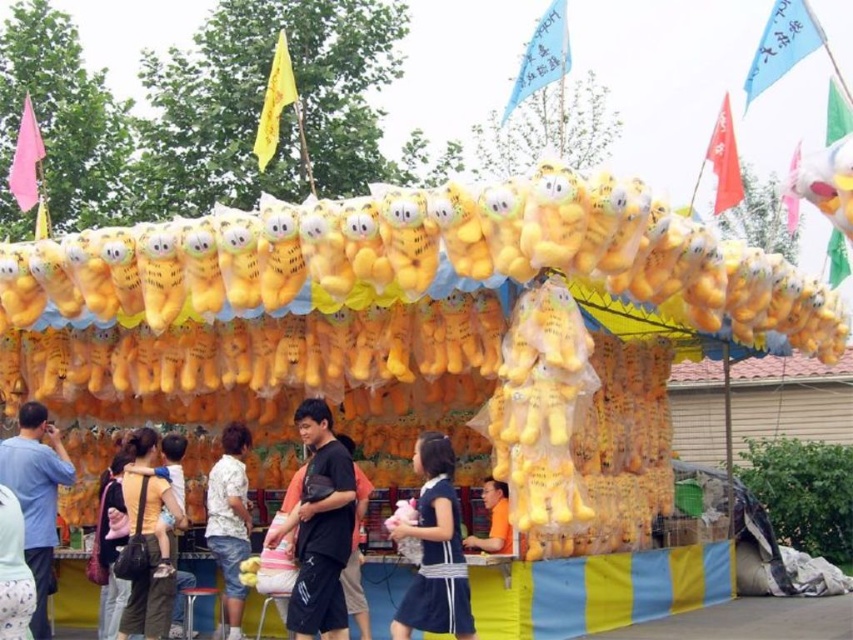
You are a person standing at the center of the carnival booth and want to grab both the dark blue cotton dress at center and the white cotton shirt at center. Can you reach both items without moving your position?

The dark blue cotton dress at center and white cotton shirt at center are 7.69 feet apart, so you cannot reach both items without moving your position because the distance between them is too large.